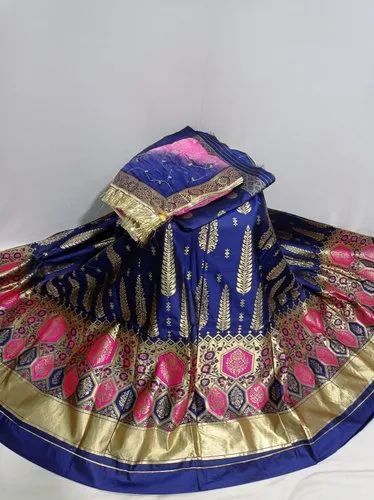
Identify the location of layed out fabric. This screenshot has width=374, height=500. (201, 276).